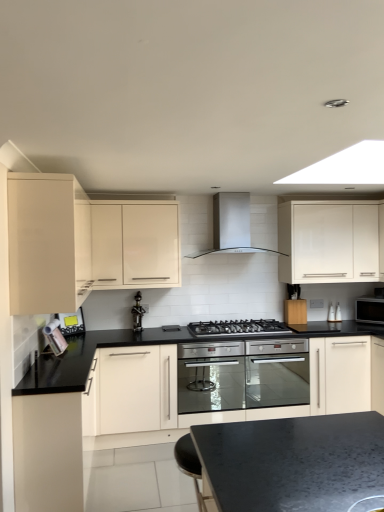
In the scene shown: Measure the distance between point (243,209) and camera.

The distance of point (243,209) from camera is 14.11 feet.

In order to face white glossy cabinet at upper right, the first cabinetry positioned from the right, should I rotate leftwards or rightwards?

It's best to rotate right around 18.213 degrees.

In order to face metallic black wine rack at center, which is the second appliance from right to left, should I rotate leftwards or rightwards?

You should rotate left by 7.112 degrees.

You are a GUI agent. You are given a task and a screenshot of the screen. Output one action in this format:
    pyautogui.click(x=<x>, y=<y>)
    Task: Click on the metallic black wine rack at center, which is the second appliance from right to left
    
    Given the screenshot: What is the action you would take?
    pyautogui.click(x=137, y=313)

Locate an element on the screen. This screenshot has height=512, width=384. metallic silver toaster at lower left, the 1th appliance viewed from the left is located at coordinates (71, 322).

Describe the element at coordinates (238, 328) in the screenshot. I see `black matte gas stove at center` at that location.

This screenshot has width=384, height=512. What do you see at coordinates (135, 244) in the screenshot?
I see `white glossy cabinet at upper center, acting as the 2th cabinetry starting from the left` at bounding box center [135, 244].

At what (x,y) coordinates should I click in order to perform the action: click on satin silver range hood at center. Please return your answer as a coordinate pair (x, y). The width and height of the screenshot is (384, 512). Looking at the image, I should click on (x=231, y=225).

Locate an element on the screen. gas stove below the white glossy cabinet at upper right, the first cabinetry positioned from the right (from the image's perspective) is located at coordinates (238, 328).

Is white glossy cabinet at upper right, the first cabinetry positioned from the right, oriented towards black matte gas stove at center?

No, white glossy cabinet at upper right, the first cabinetry positioned from the right, is not aimed at black matte gas stove at center.

Can you confirm if white glossy cabinet at upper right, the first cabinetry positioned from the right, is wider than black matte gas stove at center?

Incorrect, the width of white glossy cabinet at upper right, the first cabinetry positioned from the right, does not surpass that of black matte gas stove at center.

Is white glossy cabinet at upper right, the first cabinetry positioned from the right, smaller than black matte gas stove at center?

No.

Image resolution: width=384 pixels, height=512 pixels. Find the location of `appliance in front of the satin silver range hood at center`. appliance in front of the satin silver range hood at center is located at coordinates (71, 322).

How different are the orientations of metallic silver toaster at lower left, which is the 1th appliance in front-to-back order, and satin silver range hood at center in degrees?

40 degrees separate the facing orientations of metallic silver toaster at lower left, which is the 1th appliance in front-to-back order, and satin silver range hood at center.

Can you confirm if metallic silver toaster at lower left, the 3th appliance viewed from the back, is smaller than satin silver range hood at center?

Correct, metallic silver toaster at lower left, the 3th appliance viewed from the back, occupies less space than satin silver range hood at center.

Measure the distance from metallic silver toaster at lower left, which is the 1th appliance in front-to-back order, to satin silver range hood at center.

metallic silver toaster at lower left, which is the 1th appliance in front-to-back order, and satin silver range hood at center are 1.64 meters apart from each other.

Considering the positions of objects metallic black wine rack at center, the second appliance in the front-to-back sequence, and black matte gas stove at center in the image provided, who is more to the left, metallic black wine rack at center, the second appliance in the front-to-back sequence, or black matte gas stove at center?

metallic black wine rack at center, the second appliance in the front-to-back sequence.

From a real-world perspective, is metallic black wine rack at center, the second appliance in the front-to-back sequence, on top of black matte gas stove at center?

Yes, from a real-world perspective, metallic black wine rack at center, the second appliance in the front-to-back sequence, is on top of black matte gas stove at center.

From the image's perspective, is metallic black wine rack at center, the second appliance from the left, located above or below black matte gas stove at center?

metallic black wine rack at center, the second appliance from the left, is situated higher than black matte gas stove at center in the image.

Is white glossy cabinet at upper right, the 3th cabinetry when ordered from left to right, at the left side of metallic silver toaster at lower left, the 3th appliance viewed from the back?

In fact, white glossy cabinet at upper right, the 3th cabinetry when ordered from left to right, is to the right of metallic silver toaster at lower left, the 3th appliance viewed from the back.

Which point is more forward, (315,256) or (78,320)?

The point (78,320) is more forward.

From their relative heights in the image, would you say white glossy cabinet at upper right, the 3th cabinetry when ordered from left to right, is taller or shorter than metallic silver toaster at lower left, the 1th appliance viewed from the left?

Clearly, white glossy cabinet at upper right, the 3th cabinetry when ordered from left to right, is taller compared to metallic silver toaster at lower left, the 1th appliance viewed from the left.

Is metallic silver toaster at lower left, which is the 1th appliance in front-to-back order, inside the boundaries of metallic black wine rack at center, the second appliance from the left, or outside?

metallic silver toaster at lower left, which is the 1th appliance in front-to-back order, is not enclosed by metallic black wine rack at center, the second appliance from the left.

Locate an element on the screen. This screenshot has height=512, width=384. the 1st appliance behind the metallic silver toaster at lower left, which is the 1th appliance in front-to-back order is located at coordinates 137,313.

From the image's perspective, relative to metallic black wine rack at center, which is the second appliance from right to left, is metallic silver toaster at lower left, which is the 1th appliance in front-to-back order, above or below?

From the image's perspective, metallic silver toaster at lower left, which is the 1th appliance in front-to-back order, appears below metallic black wine rack at center, which is the second appliance from right to left.

Does metallic silver toaster at lower left, which is the 1th appliance in front-to-back order, turn towards metallic black wine rack at center, which is the second appliance from back to front?

No, metallic silver toaster at lower left, which is the 1th appliance in front-to-back order, is not turned towards metallic black wine rack at center, which is the second appliance from back to front.

From the image's perspective, is metallic black wine rack at center, which is the second appliance from back to front, above metallic silver toaster at lower left, positioned as the 3th appliance in right-to-left order?

Indeed, from the image's perspective, metallic black wine rack at center, which is the second appliance from back to front, is shown above metallic silver toaster at lower left, positioned as the 3th appliance in right-to-left order.

The width and height of the screenshot is (384, 512). I want to click on the 2nd appliance below the metallic black wine rack at center, which is the second appliance from back to front (from the image's perspective), so click(71, 322).

Is metallic black wine rack at center, which is the second appliance from right to left, bigger than metallic silver toaster at lower left, the 3th appliance viewed from the back?

→ Yes, metallic black wine rack at center, which is the second appliance from right to left, is bigger than metallic silver toaster at lower left, the 3th appliance viewed from the back.

Does metallic black wine rack at center, the second appliance in the front-to-back sequence, turn towards metallic silver toaster at lower left, positioned as the 3th appliance in right-to-left order?

No, metallic black wine rack at center, the second appliance in the front-to-back sequence, does not turn towards metallic silver toaster at lower left, positioned as the 3th appliance in right-to-left order.

Considering the sizes of matte cream cabinet at left, the third cabinetry viewed from the right, and satin silver range hood at center in the image, is matte cream cabinet at left, the third cabinetry viewed from the right, taller or shorter than satin silver range hood at center?

Clearly, matte cream cabinet at left, the third cabinetry viewed from the right, is taller compared to satin silver range hood at center.

From the image's perspective, is matte cream cabinet at left, the third cabinetry viewed from the right, above or below satin silver range hood at center?

From the image's perspective, matte cream cabinet at left, the third cabinetry viewed from the right, appears below satin silver range hood at center.

Who is more distant, matte cream cabinet at left, the third cabinetry viewed from the right, or satin silver range hood at center?

satin silver range hood at center.

Between matte cream cabinet at left, the third cabinetry viewed from the right, and satin silver range hood at center, which one appears on the right side from the viewer's perspective?

satin silver range hood at center.

Where is `gas stove lying in front of the white glossy cabinet at upper right, the first cabinetry positioned from the right`? The width and height of the screenshot is (384, 512). gas stove lying in front of the white glossy cabinet at upper right, the first cabinetry positioned from the right is located at coordinates (238, 328).

The width and height of the screenshot is (384, 512). I want to click on the 3rd appliance below the satin silver range hood at center (from the image's perspective), so [x=71, y=322].

Looking at the image, which one is located closer to white glossy cabinet at upper center, acting as the 2th cabinetry starting from the left, metallic black wine rack at center, the second appliance from the left, or satin silver range hood at center?

metallic black wine rack at center, the second appliance from the left, lies closer to white glossy cabinet at upper center, acting as the 2th cabinetry starting from the left, than the other object.

Based on the photo, from the image, which object appears to be nearer to metallic black wine rack at center, the second appliance from the left, matte cream cabinet at left, the first cabinetry when ordered from left to right, or white glossy cabinet at upper center, acting as the 2th cabinetry starting from the left?

white glossy cabinet at upper center, acting as the 2th cabinetry starting from the left, lies closer to metallic black wine rack at center, the second appliance from the left, than the other object.

Which object lies nearer to the anchor point white glossy cabinet at upper right, the first cabinetry positioned from the right, matte cream cabinet at left, the first cabinetry when ordered from left to right, or black matte gas stove at center?

Among the two, black matte gas stove at center is located nearer to white glossy cabinet at upper right, the first cabinetry positioned from the right.

From the image, which object appears to be nearer to metallic black wine rack at center, the second appliance in the front-to-back sequence, black glass microwave at right, the third appliance in the left-to-right sequence, or matte cream cabinet at left, the third cabinetry viewed from the right?

matte cream cabinet at left, the third cabinetry viewed from the right, is closer to metallic black wine rack at center, the second appliance in the front-to-back sequence.

Which object lies nearer to the anchor point white glossy cabinet at upper right, the 3th cabinetry when ordered from left to right, metallic silver toaster at lower left, positioned as the 3th appliance in right-to-left order, or metallic black wine rack at center, the second appliance in the front-to-back sequence?

Based on the image, metallic black wine rack at center, the second appliance in the front-to-back sequence, appears to be nearer to white glossy cabinet at upper right, the 3th cabinetry when ordered from left to right.

Considering their positions, is metallic black wine rack at center, which is the second appliance from back to front, positioned closer to black matte gas stove at center than white glossy cabinet at upper right, the 3th cabinetry when ordered from left to right?

Based on the image, metallic black wine rack at center, which is the second appliance from back to front, appears to be nearer to black matte gas stove at center.

Which object lies nearer to the anchor point black matte gas stove at center, metallic silver toaster at lower left, positioned as the 3th appliance in right-to-left order, or black glass microwave at right, the 1th appliance when ordered from back to front?

The object closer to black matte gas stove at center is black glass microwave at right, the 1th appliance when ordered from back to front.

Estimate the real-world distances between objects in this image. Which object is closer to black glass microwave at right, which is counted as the first appliance, starting from the right, metallic black wine rack at center, the second appliance from the left, or metallic silver toaster at lower left, which is the 1th appliance in front-to-back order?

metallic black wine rack at center, the second appliance from the left, is positioned closer to the anchor black glass microwave at right, which is counted as the first appliance, starting from the right.

Where is `cabinetry located between matte cream cabinet at left, the third cabinetry viewed from the right, and satin silver range hood at center in the depth direction`? cabinetry located between matte cream cabinet at left, the third cabinetry viewed from the right, and satin silver range hood at center in the depth direction is located at coordinates (135, 244).

You are a GUI agent. You are given a task and a screenshot of the screen. Output one action in this format:
    pyautogui.click(x=<x>, y=<y>)
    Task: Click on the appliance located between metallic silver toaster at lower left, the 1th appliance viewed from the left, and satin silver range hood at center in the left-right direction
    The height and width of the screenshot is (512, 384).
    Given the screenshot: What is the action you would take?
    pyautogui.click(x=137, y=313)

Where is `appliance between matte cream cabinet at left, the first cabinetry when ordered from left to right, and white glossy cabinet at upper right, the 3th cabinetry when ordered from left to right`? appliance between matte cream cabinet at left, the first cabinetry when ordered from left to right, and white glossy cabinet at upper right, the 3th cabinetry when ordered from left to right is located at coordinates (137, 313).

Image resolution: width=384 pixels, height=512 pixels. What are the coordinates of `gas stove between matte cream cabinet at left, the third cabinetry viewed from the right, and white glossy cabinet at upper right, the first cabinetry positioned from the right` in the screenshot? It's located at (238, 328).